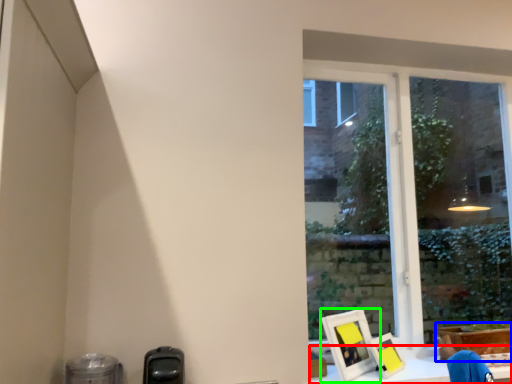
Question: Which is farther away from workbench (highlighted by a red box)? cardboard box (highlighted by a blue box) or picture frame (highlighted by a green box)?

Choices:
 (A) cardboard box
 (B) picture frame

Answer: (A)